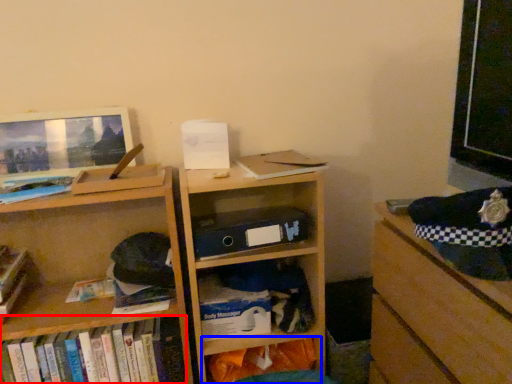
Question: Which of the following is the closest to the observer, book (highlighted by a red box) or shelf (highlighted by a blue box)?

Choices:
 (A) book
 (B) shelf

Answer: (A)